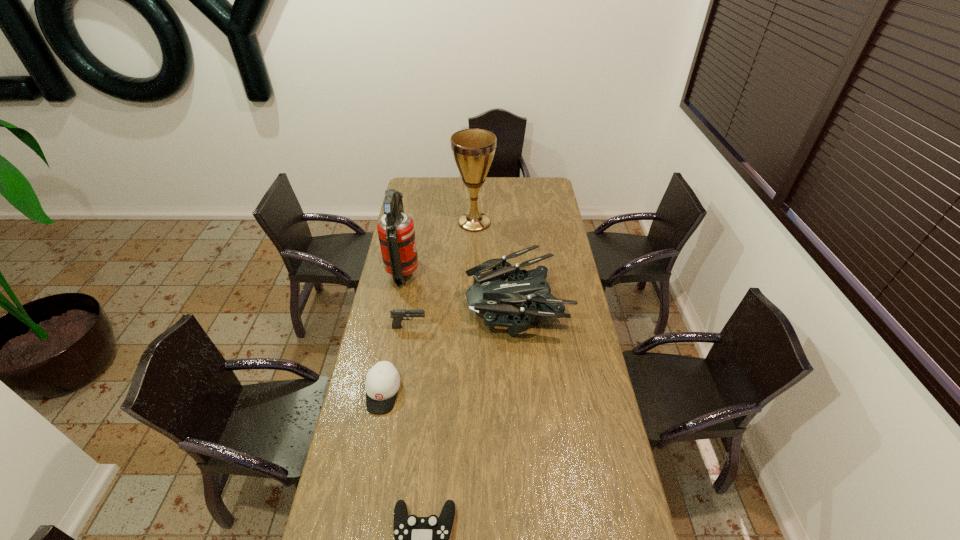
This screenshot has height=540, width=960. I want to click on fire extinguisher located at the left edge, so click(396, 233).

The height and width of the screenshot is (540, 960). I want to click on pistol that is at the left edge, so click(x=397, y=314).

Where is `baseball cap at the left edge`? This screenshot has width=960, height=540. baseball cap at the left edge is located at coordinates [382, 383].

Identify the location of object present at the right edge. This screenshot has width=960, height=540. (490, 294).

In the image, there is a desktop. Identify the location of free space at the left edge. The height and width of the screenshot is (540, 960). (350, 539).

Locate an element on the screen. vacant space at the right edge of the desktop is located at coordinates (604, 510).

What are the coordinates of `vacant space at the far left corner of the desktop` in the screenshot? It's located at (416, 194).

Where is `free point between the fire extinguisher and the third tallest object`? The image size is (960, 540). free point between the fire extinguisher and the third tallest object is located at coordinates (460, 287).

You are a GUI agent. You are given a task and a screenshot of the screen. Output one action in this format:
    pyautogui.click(x=<x>, y=<y>)
    Task: Click on the vacant area that lies between the fire extinguisher and the pistol
    The height and width of the screenshot is (540, 960).
    Given the screenshot: What is the action you would take?
    pyautogui.click(x=406, y=300)

Locate an element on the screen. This screenshot has height=540, width=960. free space between the fire extinguisher and the pistol is located at coordinates (406, 300).